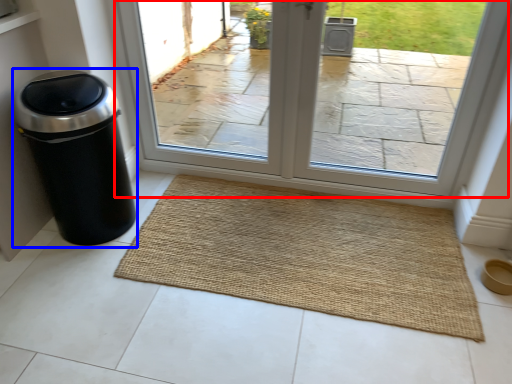
Question: Which object appears farthest to the camera in this image, window (highlighted by a red box) or waste container (highlighted by a blue box)?

Choices:
 (A) window
 (B) waste container

Answer: (A)